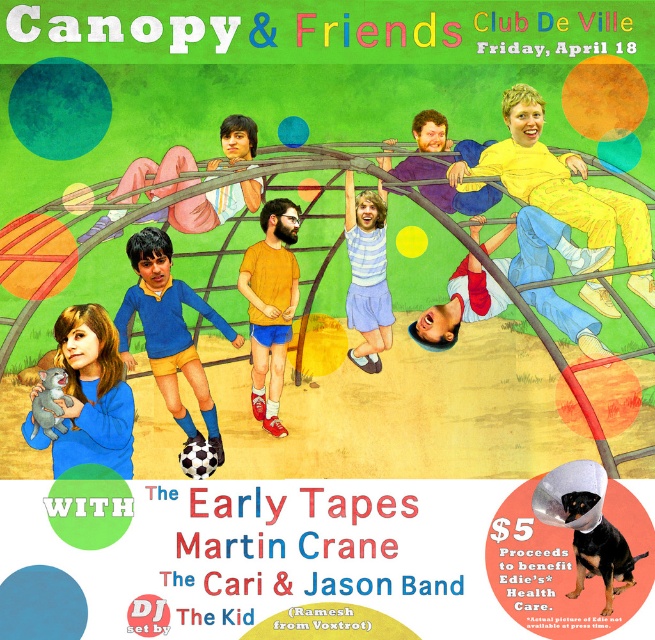
Question: Which of the following is the closest to the observer?

Choices:
 (A) blue soft toy at lower left
 (B) blue fabric shirt at center
 (C) matte yellow t-shirt at center
 (D) white cotton shirt at center

Answer: (A)

Question: Which point appears farthest from the camera in this image?

Choices:
 (A) (100, 424)
 (B) (436, 170)
 (C) (267, 358)
 (D) (512, 147)

Answer: (C)

Question: Estimate the real-world distances between objects in this image. Which object is closer to the striped fabric shirt at center?

Choices:
 (A) blue fabric shirt at center
 (B) blue jersey at center
 (C) matte yellow t-shirt at center

Answer: (C)

Question: Is white cotton shirt at center wider than striped fabric shirt at center?

Choices:
 (A) yes
 (B) no

Answer: (A)

Question: Does yellow matte pants at upper right have a smaller size compared to blue soft toy at lower left?

Choices:
 (A) yes
 (B) no

Answer: (A)

Question: Considering the relative positions of blue soft toy at lower left and striped fabric shirt at center in the image provided, where is blue soft toy at lower left located with respect to striped fabric shirt at center?

Choices:
 (A) above
 (B) below

Answer: (B)